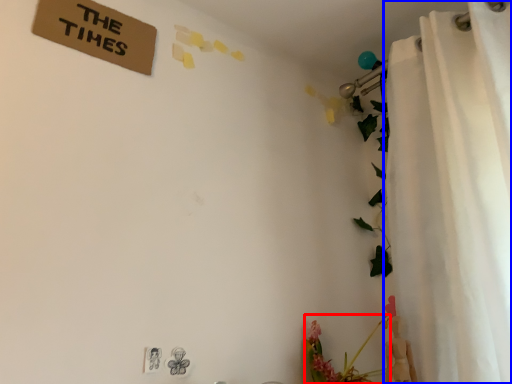
Question: Which object appears farthest to the camera in this image, floral arrangement (highlighted by a red box) or curtain (highlighted by a blue box)?

Choices:
 (A) floral arrangement
 (B) curtain

Answer: (A)